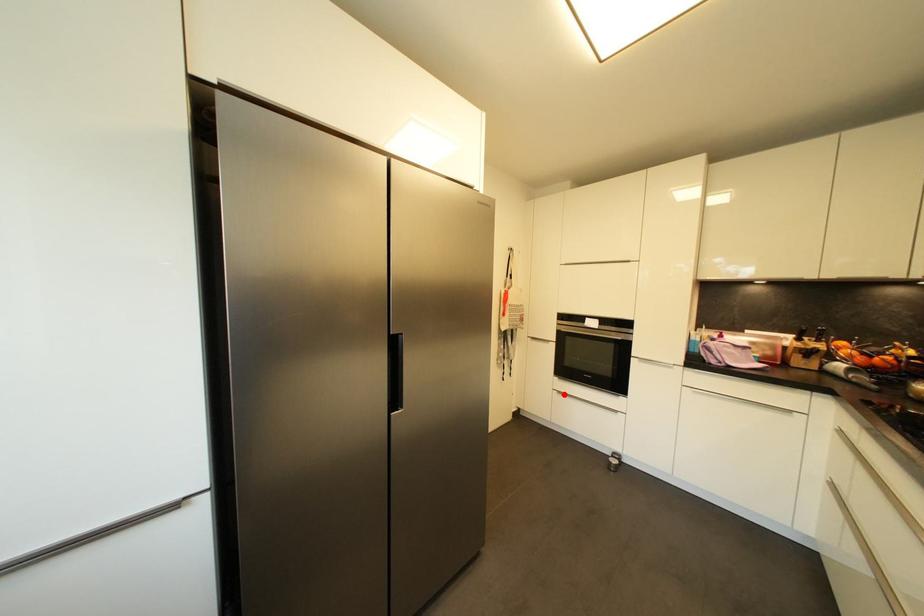
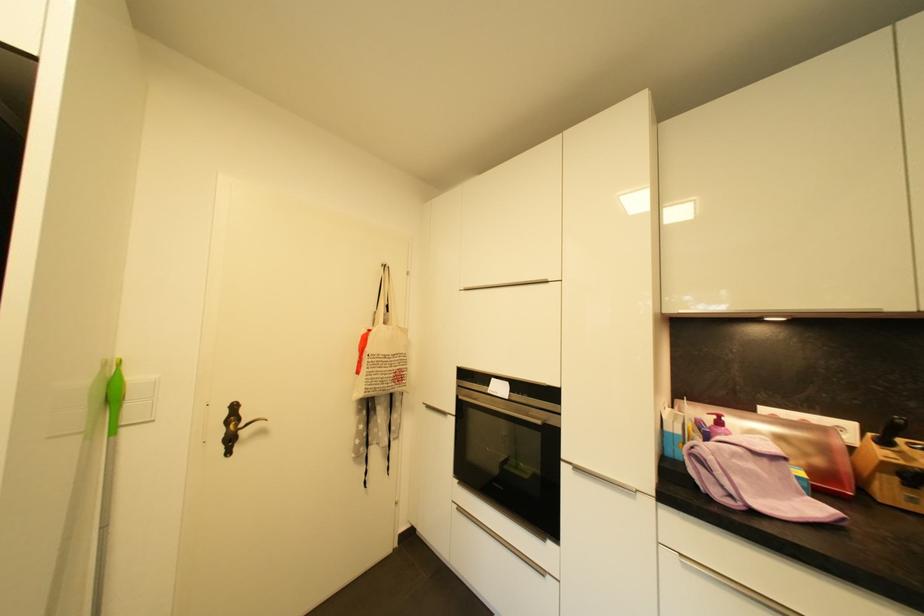
Question: A red point is marked in image1. In image2, is the corresponding 3D point closer to the camera or farther? Reply with the corresponding letter.

Choices:
 (A) The corresponding 3D point is closer.
 (B) The corresponding 3D point is farther.

Answer: (A)